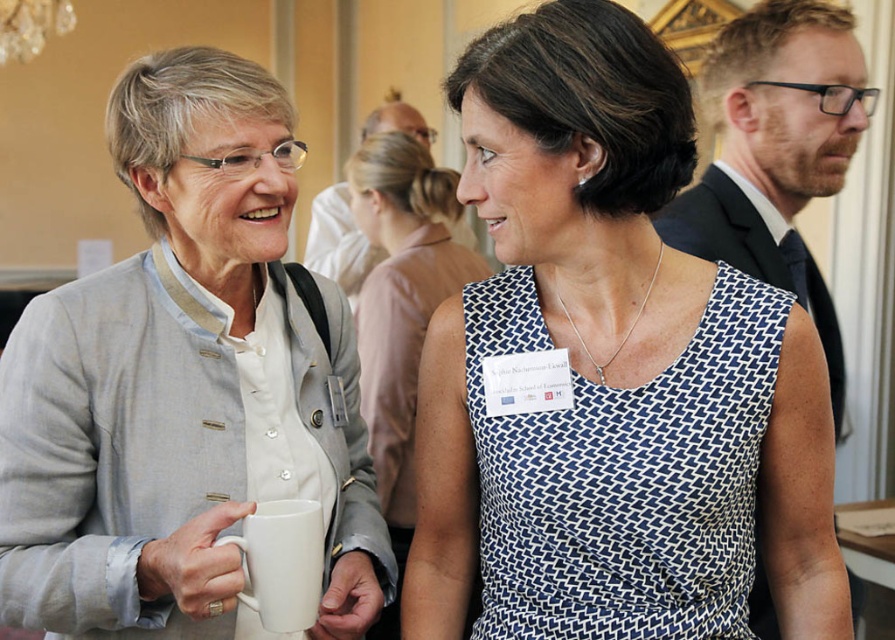
Does point (499, 632) come farther from viewer compared to point (422, 330)?

No, (499, 632) is closer to viewer.

Between blue printed dress at center and white dotted dress at center, which one is positioned higher?

Positioned higher is blue printed dress at center.

What are the coordinates of `blue printed dress at center` in the screenshot? It's located at tap(612, 372).

Locate an element on the screen. blue printed dress at center is located at coordinates (612, 372).

Consider the image. Does light gray fabric jacket at upper left have a lesser height compared to white matte mug at center?

Incorrect, light gray fabric jacket at upper left's height does not fall short of white matte mug at center's.

Between light gray fabric jacket at upper left and white matte mug at center, which one has more height?

light gray fabric jacket at upper left is taller.

Find the location of a particular element. This screenshot has width=895, height=640. light gray fabric jacket at upper left is located at coordinates (184, 385).

Between blue printed dress at center and light gray fabric jacket at upper left, which one is positioned higher?

Positioned higher is light gray fabric jacket at upper left.

Is blue printed dress at center shorter than light gray fabric jacket at upper left?

In fact, blue printed dress at center may be taller than light gray fabric jacket at upper left.

Describe the element at coordinates (612, 372) in the screenshot. I see `blue printed dress at center` at that location.

This screenshot has width=895, height=640. What are the coordinates of `blue printed dress at center` in the screenshot? It's located at (612, 372).